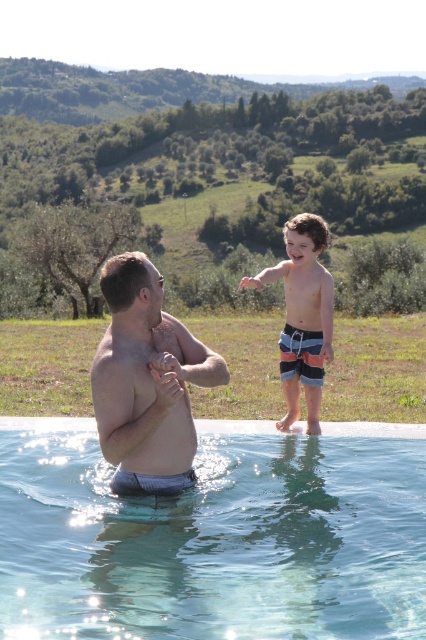
Question: Does clear glass water at center appear on the left side of striped board shorts at upper right?

Choices:
 (A) no
 (B) yes

Answer: (B)

Question: Which object is the farthest from the striped board shorts at upper right?

Choices:
 (A) clear glass water at center
 (B) matte skin man at center

Answer: (B)

Question: Which point appears closest to the camera in this image?

Choices:
 (A) (290, 355)
 (B) (123, 349)

Answer: (B)

Question: Among these points, which one is farthest from the camera?

Choices:
 (A) (288, 371)
 (B) (100, 273)
 (C) (146, 589)

Answer: (B)

Question: Does clear glass water at center appear over striped board shorts at upper right?

Choices:
 (A) yes
 (B) no

Answer: (B)

Question: Is clear glass water at center behind striped board shorts at upper right?

Choices:
 (A) yes
 (B) no

Answer: (B)